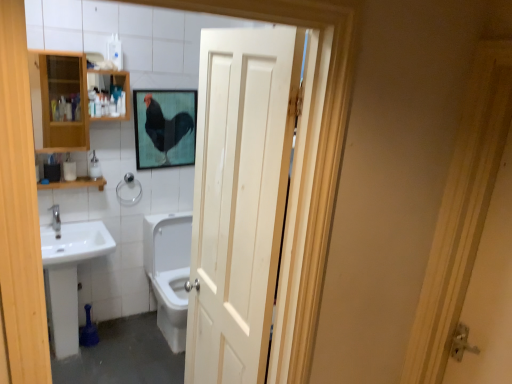
Measure the distance between point (52, 55) and camera.

Point (52, 55) and camera are 2.49 meters apart from each other.

The width and height of the screenshot is (512, 384). In order to click on wooden cabinet at left in this screenshot , I will do `click(58, 99)`.

You are a GUI agent. You are given a task and a screenshot of the screen. Output one action in this format:
    pyautogui.click(x=<x>, y=<y>)
    Task: Click on the white glossy soap dispenser at left
    This screenshot has height=384, width=512.
    Given the screenshot: What is the action you would take?
    coord(94,167)

What is the approximate width of white glossy soap dispenser at left?

It is 2.94 inches.

Image resolution: width=512 pixels, height=384 pixels. Describe the element at coordinates (69, 276) in the screenshot. I see `white glossy sink at left` at that location.

Identify the location of wooden cabinet at left. (58, 99).

Based on their positions, is wooden shelf at left located to the left or right of white glossy soap dispenser at left?

In the image, wooden shelf at left appears on the left side of white glossy soap dispenser at left.

In terms of height, does wooden shelf at left look taller or shorter compared to white glossy soap dispenser at left?

Considering their sizes, wooden shelf at left has less height than white glossy soap dispenser at left.

This screenshot has width=512, height=384. What are the coordinates of `balustrade that is on the left side of white glossy soap dispenser at left` in the screenshot? It's located at (75, 183).

Can you tell me how much wooden shelf at left and white glossy soap dispenser at left differ in facing direction?

The angle between the facing direction of wooden shelf at left and the facing direction of white glossy soap dispenser at left is 2.16 degrees.

In the scene shown: Which is closer to the camera, (32, 85) or (141, 189)?

The point (141, 189) is closer.

Where is `towel bar located on the right of wooden cabinet at left`? The width and height of the screenshot is (512, 384). towel bar located on the right of wooden cabinet at left is located at coordinates (127, 183).

Which object is positioned more to the left, wooden cabinet at left or silver metallic towel bar at center left?

From the viewer's perspective, wooden cabinet at left appears more on the left side.

Measure the distance from wooden cabinet at left to silver metallic towel bar at center left.

They are 1.87 meters apart.

Is white glossy sink at left at the right side of wooden cabinet at left?

No, white glossy sink at left is not to the right of wooden cabinet at left.

Is white glossy sink at left not close to wooden cabinet at left?

Yes, white glossy sink at left is far from wooden cabinet at left.

Is white glossy sink at left looking in the opposite direction of wooden cabinet at left?

No, white glossy sink at left's orientation is not away from wooden cabinet at left.

Is white glossy sink at left taller or shorter than wooden cabinet at left?

white glossy sink at left is taller than wooden cabinet at left.

Considering the sizes of objects white matte toilet paper at left and white glossy sink at left in the image provided, who is wider, white matte toilet paper at left or white glossy sink at left?

Wider between the two is white glossy sink at left.

Is white matte toilet paper at left not within white glossy sink at left?

white matte toilet paper at left lies outside white glossy sink at left's area.

From a real-world perspective, between white matte toilet paper at left and white glossy sink at left, who is vertically higher?

From a 3D spatial view, white matte toilet paper at left is above.

Based on the photo, is white glossy soap dispenser at left not near matte black rooster at upper center?

white glossy soap dispenser at left is near matte black rooster at upper center, not far away.

From a real-world perspective, is white glossy soap dispenser at left located beneath matte black rooster at upper center?

Indeed, from a real-world perspective, white glossy soap dispenser at left is positioned beneath matte black rooster at upper center.

Considering the relative positions of white glossy soap dispenser at left and matte black rooster at upper center in the image provided, is white glossy soap dispenser at left to the left of matte black rooster at upper center from the viewer's perspective?

Indeed, white glossy soap dispenser at left is positioned on the left side of matte black rooster at upper center.

From the image's perspective, which is below, white glossy soap dispenser at left or matte black rooster at upper center?

white glossy soap dispenser at left.

Find the location of a particular element. Image resolution: width=512 pixels, height=384 pixels. towel bar that appears behind the white wood door at center is located at coordinates (127, 183).

Which of these two, silver metallic towel bar at center left or white wood door at center, is thinner?

With smaller width is silver metallic towel bar at center left.

Considering the relative sizes of silver metallic towel bar at center left and white wood door at center in the image provided, is silver metallic towel bar at center left bigger than white wood door at center?

Incorrect, silver metallic towel bar at center left is not larger than white wood door at center.

Is silver metallic towel bar at center left far away from white wood door at center?

silver metallic towel bar at center left is far away from white wood door at center.

From a real-world perspective, is wooden shelf at left above or below matte black rooster at upper center?

From a real-world perspective, wooden shelf at left is physically below matte black rooster at upper center.

From the image's perspective, is wooden shelf at left below matte black rooster at upper center?

Yes, from the image's perspective, wooden shelf at left is below matte black rooster at upper center.

Locate an element on the screen. The image size is (512, 384). balustrade lying below the matte black rooster at upper center (from the image's perspective) is located at coordinates (75, 183).

What's the angular difference between wooden shelf at left and matte black rooster at upper center's facing directions?

0.393 degrees separate the facing orientations of wooden shelf at left and matte black rooster at upper center.

Image resolution: width=512 pixels, height=384 pixels. I want to click on toiletry on the right of the wooden shelf at left, so click(94, 167).

Identify the location of towel bar that is behind the wooden cabinet at left. (127, 183).

Looking at the image, which one is located further to white wood door at center, white glossy sink at left or white matte toilet paper at left?

white matte toilet paper at left is further to white wood door at center.

When comparing their distances from wooden cabinet at left, does white wood door at center or wooden shelf at left seem further?

Based on the image, white wood door at center appears to be further to wooden cabinet at left.

Based on their spatial positions, is silver metallic towel bar at center left or white matte toilet paper at left further from white wood door at center?

silver metallic towel bar at center left is further to white wood door at center.

Considering their positions, is wooden cabinet at left positioned closer to white matte toilet paper at left than white glossy sink at left?

white glossy sink at left is closer to white matte toilet paper at left.

From the image, which object appears to be nearer to white glossy soap dispenser at left, wooden cabinet at left or white matte toilet paper at left?

white matte toilet paper at left lies closer to white glossy soap dispenser at left than the other object.

Based on their spatial positions, is wooden shelf at left or matte black rooster at upper center closer to white wood door at center?

Among the two, matte black rooster at upper center is located nearer to white wood door at center.

Considering their positions, is white matte toilet paper at left positioned closer to wooden cabinet at left than white glossy soap dispenser at left?

Based on the image, white glossy soap dispenser at left appears to be nearer to wooden cabinet at left.

From the image, which object appears to be farther from white glossy soap dispenser at left, wooden shelf at left or matte black rooster at upper center?

matte black rooster at upper center is further to white glossy soap dispenser at left.

Locate an element on the screen. Image resolution: width=512 pixels, height=384 pixels. toiletry positioned between wooden shelf at left and silver metallic towel bar at center left from near to far is located at coordinates (94, 167).

Locate an element on the screen. The width and height of the screenshot is (512, 384). towel bar between white matte toilet paper at left and white glossy sink at left from top to bottom is located at coordinates (127, 183).

What are the coordinates of `toilet paper between wooden cabinet at left and silver metallic towel bar at center left in the front-back direction` in the screenshot? It's located at click(x=69, y=170).

Locate an element on the screen. towel bar situated between white glossy soap dispenser at left and matte black rooster at upper center from left to right is located at coordinates (127, 183).